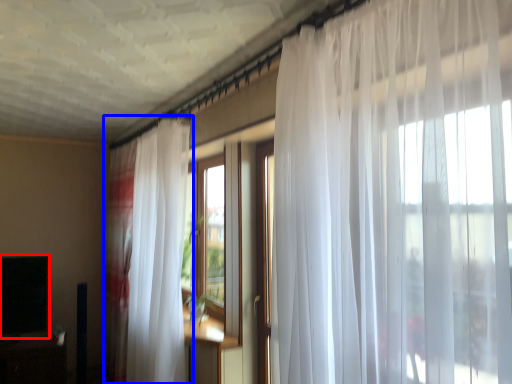
Question: Which object is closer to the camera taking this photo, window screen (highlighted by a red box) or curtain (highlighted by a blue box)?

Choices:
 (A) window screen
 (B) curtain

Answer: (B)